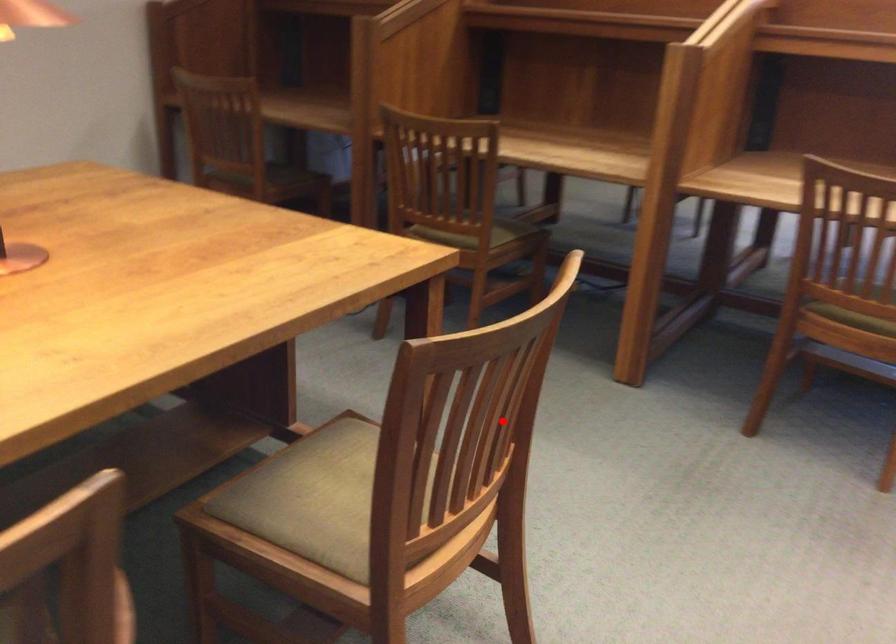
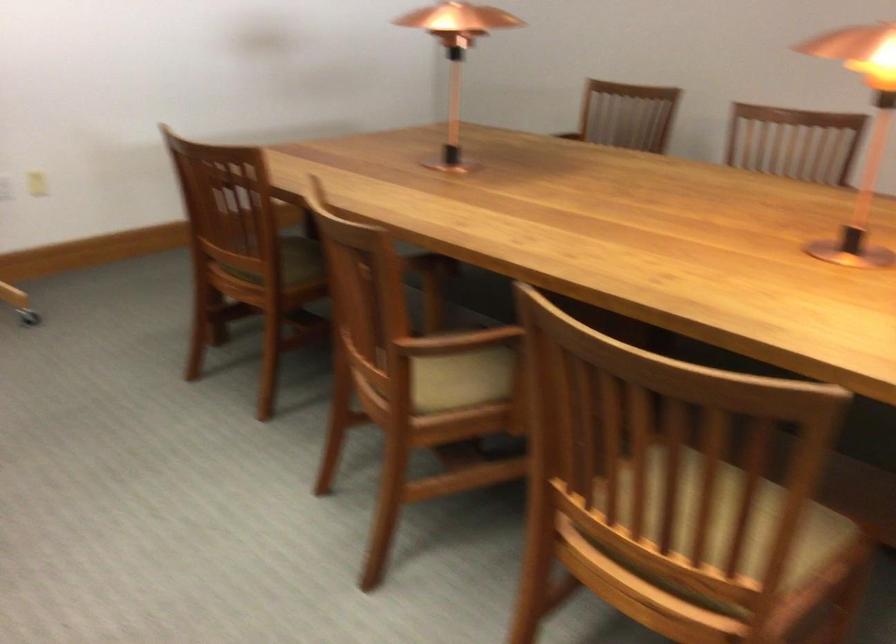
Question: I am providing you with two images of the same scene from different viewpoints. Given a red point in image1, look at the same physical point in image2. Is it:

Choices:
 (A) Closer to the viewpoint
 (B) Farther from the viewpoint

Answer: (A)